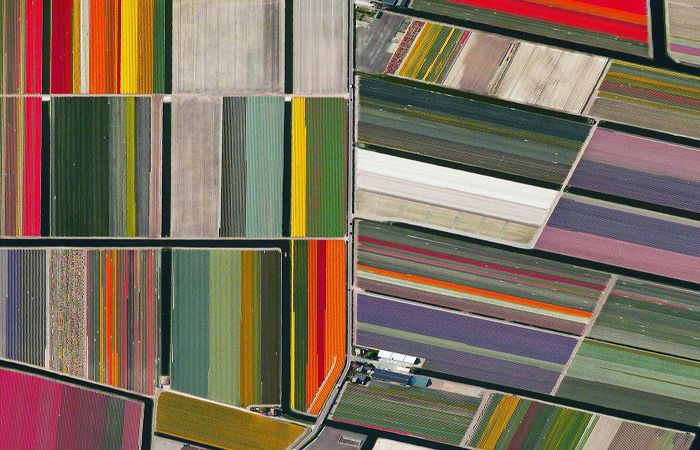
The image size is (700, 450). What are the coordinates of `three rugs from top to bottom` in the screenshot? It's located at (260, 40), (248, 190), (234, 335).